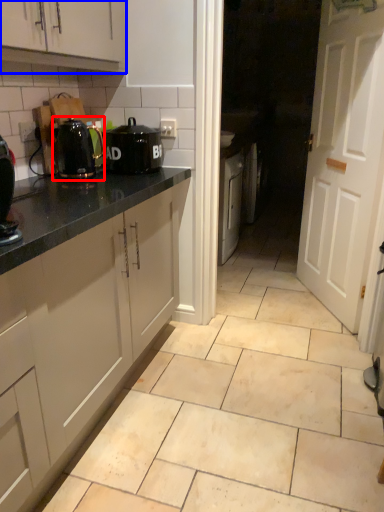
Question: Which object is further to the camera taking this photo, kitchen appliance (highlighted by a red box) or cabinetry (highlighted by a blue box)?

Choices:
 (A) kitchen appliance
 (B) cabinetry

Answer: (A)